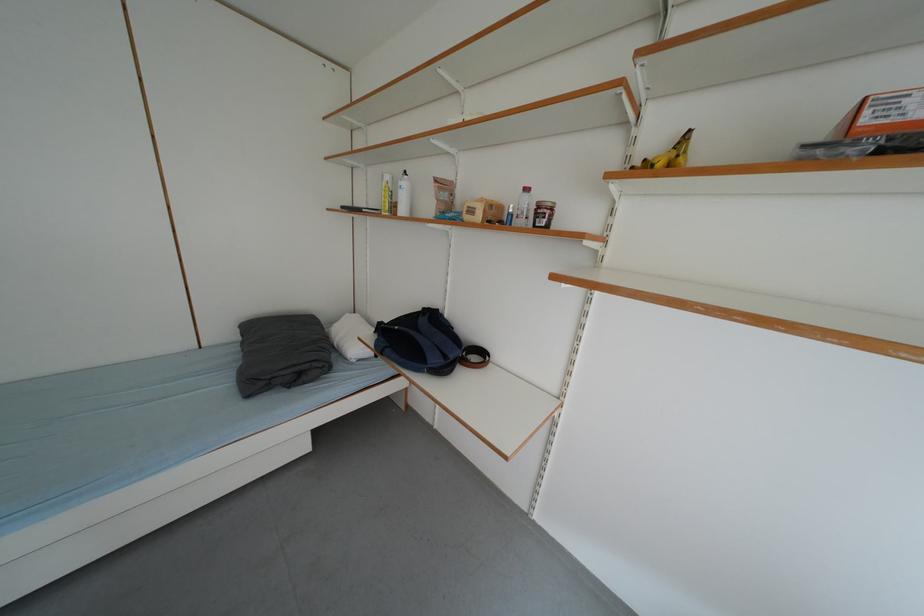
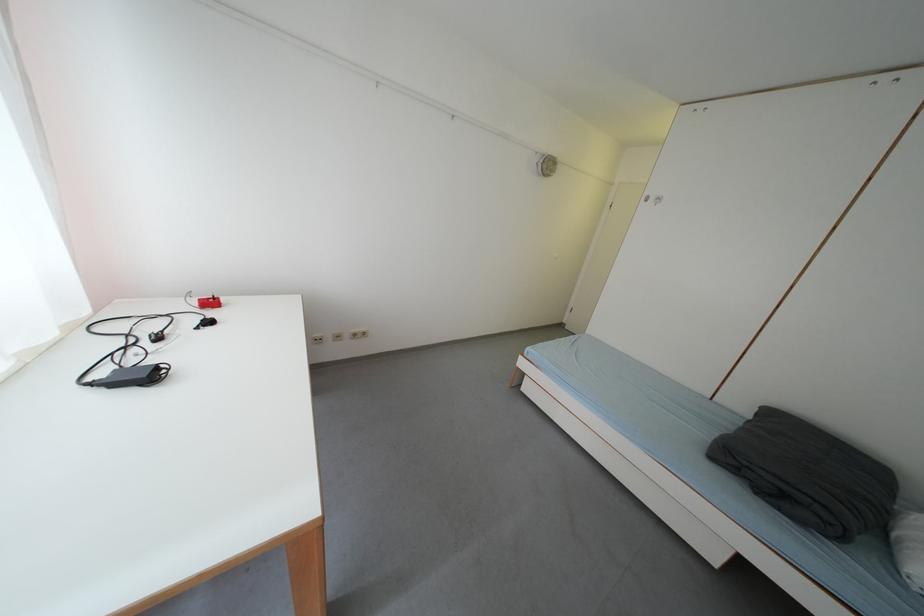
Based on the continuous images, in which direction is the camera rotating?

The camera's rotation is toward left-down.